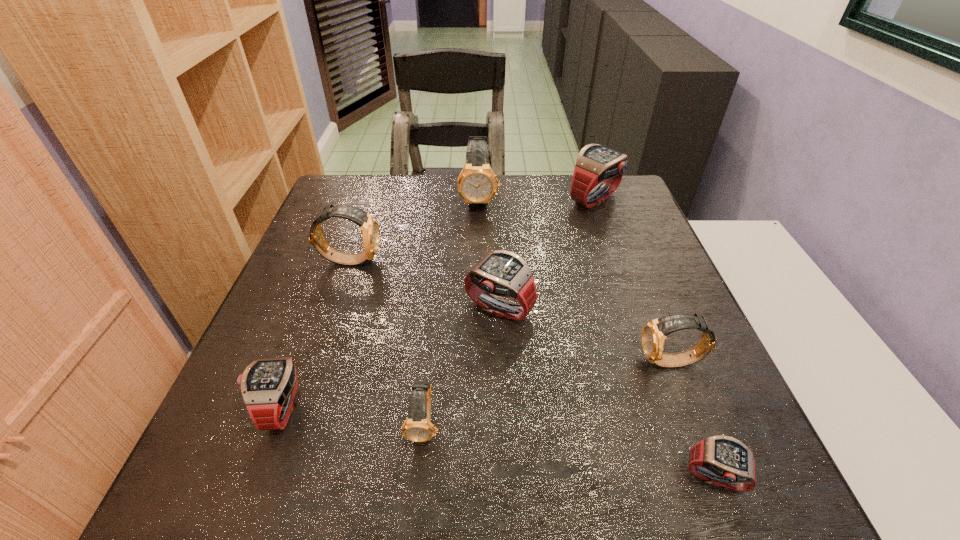
You are a GUI agent. You are given a task and a screenshot of the screen. Output one action in this format:
    pyautogui.click(x=<x>, y=<y>)
    Task: Click on the third biggest red watch
    Image resolution: width=960 pixels, height=540 pixels.
    Given the screenshot: What is the action you would take?
    pyautogui.click(x=268, y=386)

You are a GUI agent. You are given a task and a screenshot of the screen. Output one action in this format:
    pyautogui.click(x=<x>, y=<y>)
    Task: Click on the nearest gold watch
    The width and height of the screenshot is (960, 540).
    Given the screenshot: What is the action you would take?
    pyautogui.click(x=417, y=427)

The width and height of the screenshot is (960, 540). Find the location of `the third object from left to right`. the third object from left to right is located at coordinates (417, 427).

Where is `the nearest watch`? the nearest watch is located at coordinates (721, 460).

You are a GUI agent. You are given a task and a screenshot of the screen. Output one action in this format:
    pyautogui.click(x=<x>, y=<y>)
    Task: Click on the nearest red watch
    
    Given the screenshot: What is the action you would take?
    pyautogui.click(x=721, y=460)

Where is `free space located on the face of the tallest object`? free space located on the face of the tallest object is located at coordinates (479, 231).

Where is `vacant space situated 0.150m on the face of the sixth nearest watch`? The image size is (960, 540). vacant space situated 0.150m on the face of the sixth nearest watch is located at coordinates (443, 260).

Find the location of `free spot located on the left of the farthest red watch`. free spot located on the left of the farthest red watch is located at coordinates (479, 200).

You are a GUI agent. You are given a task and a screenshot of the screen. Output one action in this format:
    pyautogui.click(x=<x>, y=<y>)
    Task: Click on the free space located on the back of the second red watch from left to right
    
    Given the screenshot: What is the action you would take?
    pyautogui.click(x=494, y=200)

I want to click on free point located 0.130m on the face of the third biggest gold watch, so click(x=573, y=362).